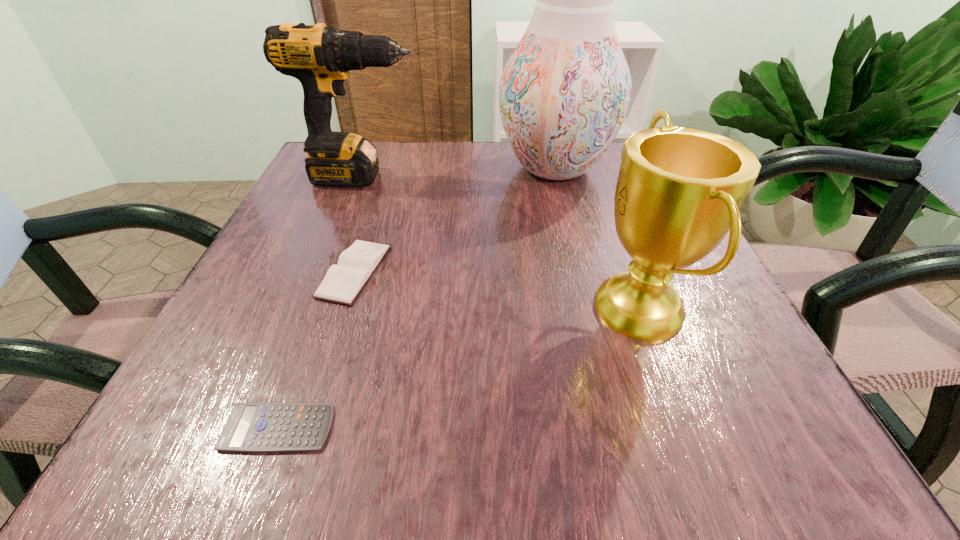
Where is `award present at the right edge`? The width and height of the screenshot is (960, 540). award present at the right edge is located at coordinates (679, 190).

The height and width of the screenshot is (540, 960). Identify the location of object that is at the far left corner. 320,57.

Where is `object that is at the near left corner`? object that is at the near left corner is located at coordinates (268, 426).

I want to click on object located in the far right corner section of the desktop, so click(x=564, y=93).

In the image, there is a desktop. At what (x,y) coordinates should I click in order to perform the action: click on vacant space at the far edge. Please return your answer as a coordinate pair (x, y). Looking at the image, I should click on (422, 150).

Where is `free region at the near edge of the desktop`? The height and width of the screenshot is (540, 960). free region at the near edge of the desktop is located at coordinates (665, 457).

Where is `vacant space at the left edge`? vacant space at the left edge is located at coordinates (308, 219).

Where is `vacant space at the right edge of the desktop`? vacant space at the right edge of the desktop is located at coordinates (611, 211).

Identify the location of vacant space at the far right corner of the desktop. This screenshot has height=540, width=960. (x=586, y=191).

In the image, there is a desktop. Where is `free space at the near right corner`? This screenshot has height=540, width=960. free space at the near right corner is located at coordinates (766, 445).